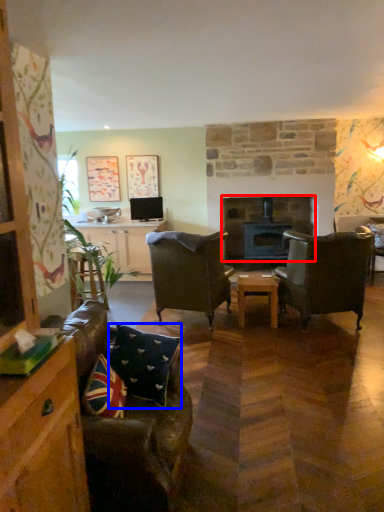
Question: Among these objects, which one is nearest to the camera, fireplace (highlighted by a red box) or pillow (highlighted by a blue box)?

Choices:
 (A) fireplace
 (B) pillow

Answer: (B)